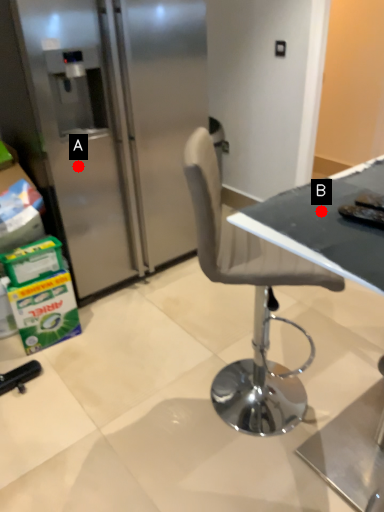
Question: Two points are circled on the image, labeled by A and B beside each circle. Which point is closer to the camera?

Choices:
 (A) A is closer
 (B) B is closer

Answer: (B)